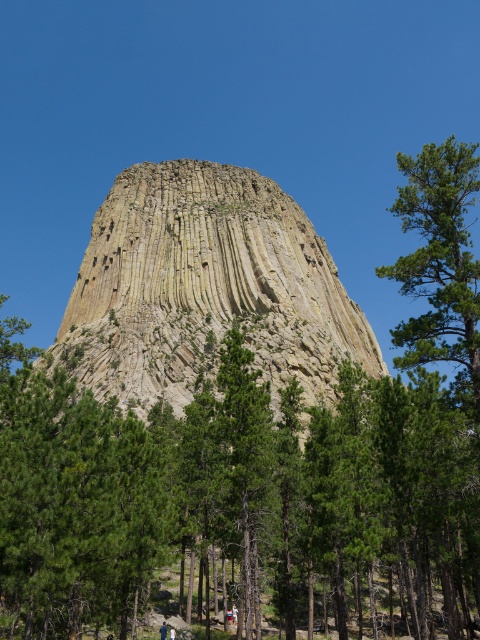
You are standing at the base of the yellowish rock formation at center. If you look towards the point at coordinates point (205, 289), what direction would you be facing relative to the rock formation?

The point at coordinates point (205, 289) is where the yellowish rock formation at center is located, so you would be facing directly at the rock formation itself.

You are hiking towards Devils Tower and want to take a photo with both the green leafy tree at center and the green textured tree at right in the frame. Which tree should you position yourself closer to in order to include both in your photo?

To include both the green leafy tree at center and the green textured tree at right in your photo, you should position yourself closer to the green leafy tree at center since it is nearer to you compared to the green textured tree at right.